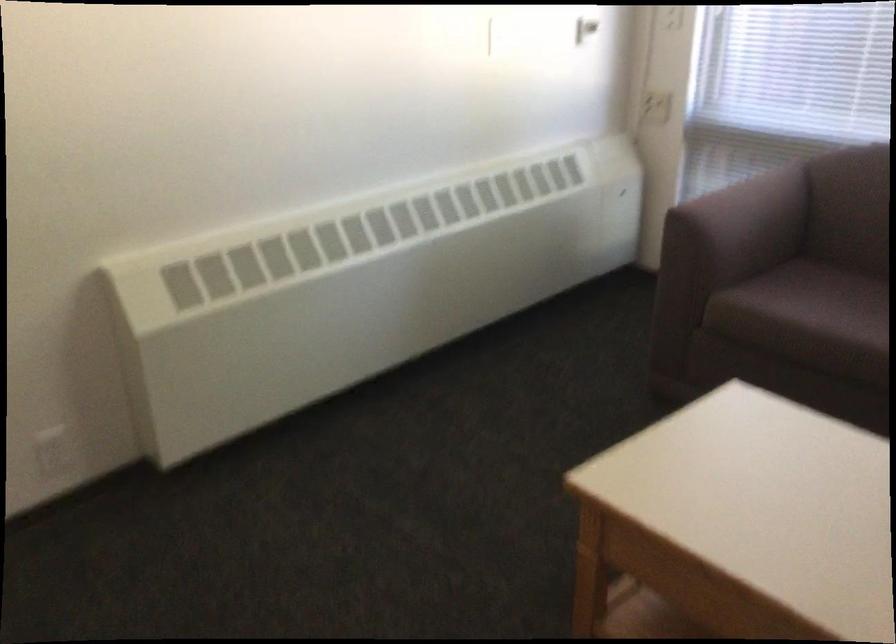
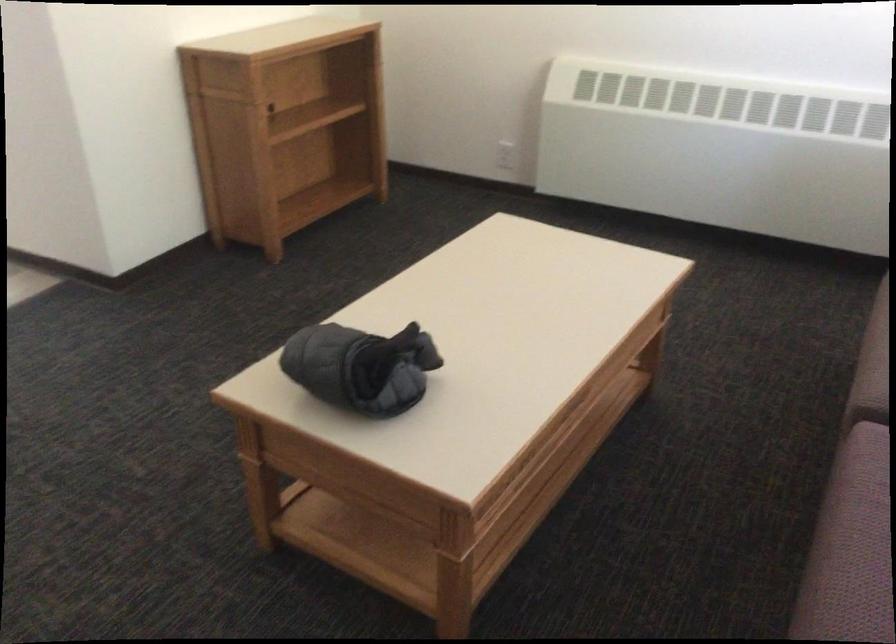
In the second image, find the point that corresponds to [88,448] in the first image.

(505, 155)